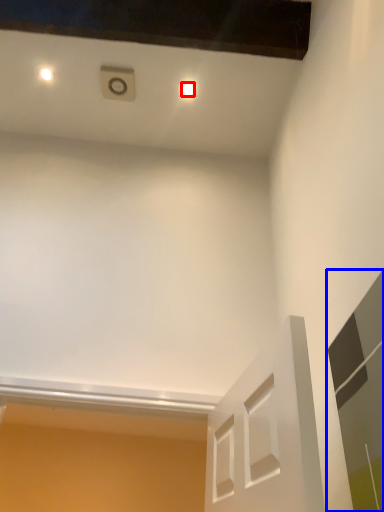
Question: Which object appears closest to the camera in this image, dot (highlighted by a red box) or glass door (highlighted by a blue box)?

Choices:
 (A) dot
 (B) glass door

Answer: (B)